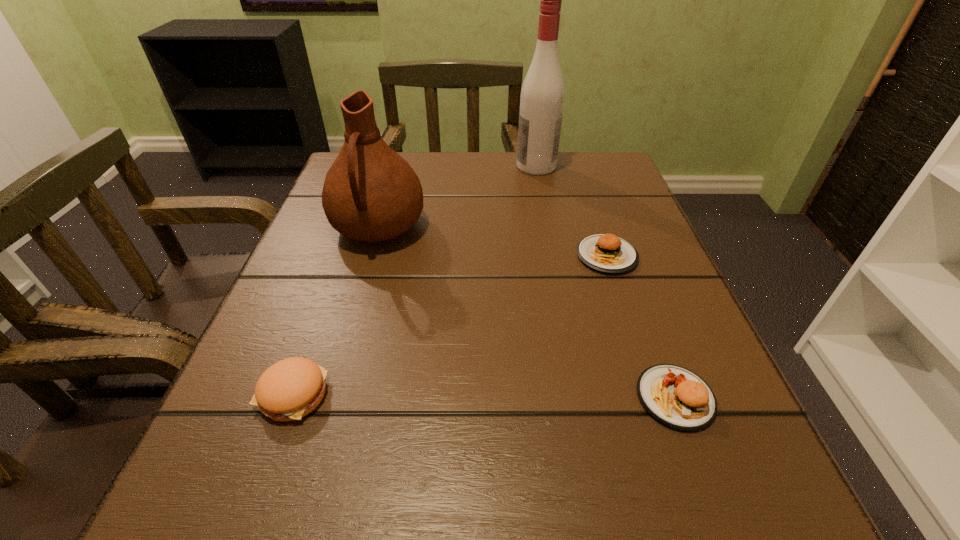
Where is `vacant point that satisfies the following two spatial constraints: 1. on the label of the farthest food; 2. on the left side of the farthest object`? The image size is (960, 540). vacant point that satisfies the following two spatial constraints: 1. on the label of the farthest food; 2. on the left side of the farthest object is located at coordinates (554, 256).

This screenshot has width=960, height=540. I want to click on vacant space that satisfies the following two spatial constraints: 1. on the front side of the leftmost food; 2. on the right side of the third tallest object, so click(x=292, y=397).

You are a GUI agent. You are given a task and a screenshot of the screen. Output one action in this format:
    pyautogui.click(x=<x>, y=<y>)
    Task: Click on the free space that satisfies the following two spatial constraints: 1. on the back side of the tallest food; 2. on the label of the farthest object
    The width and height of the screenshot is (960, 540).
    Given the screenshot: What is the action you would take?
    pyautogui.click(x=588, y=166)

Identify the location of free space that satisfies the following two spatial constraints: 1. on the side of the third tallest object with the handle; 2. on the right side of the second tallest object. (328, 397).

This screenshot has height=540, width=960. I want to click on vacant region that satisfies the following two spatial constraints: 1. on the side of the farthest food with the handle; 2. on the right side of the pitcher, so click(370, 256).

Where is `free region that satisfies the following two spatial constraints: 1. on the label of the tallest object; 2. on the side of the fourth shortest object with the handle`? This screenshot has width=960, height=540. free region that satisfies the following two spatial constraints: 1. on the label of the tallest object; 2. on the side of the fourth shortest object with the handle is located at coordinates (548, 228).

I want to click on vacant space that satisfies the following two spatial constraints: 1. on the side of the tallest food with the handle; 2. on the left side of the second tallest object, so click(328, 397).